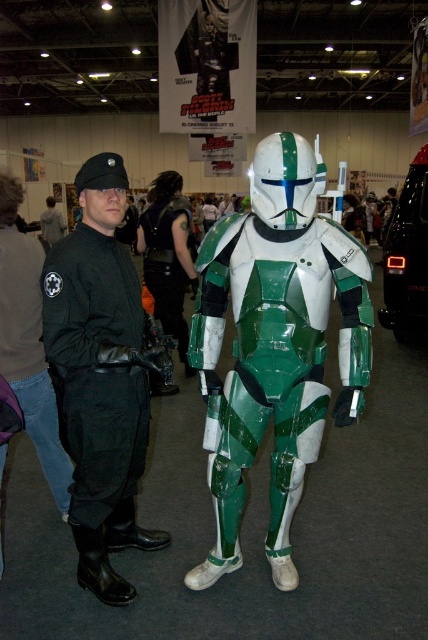
Does green matte armor at center appear on the left side of black matte jacket at left?

No, green matte armor at center is not to the left of black matte jacket at left.

Does green matte armor at center have a smaller size compared to black matte jacket at left?

No, green matte armor at center is not smaller than black matte jacket at left.

Where is `green matte armor at center`? This screenshot has width=428, height=640. green matte armor at center is located at coordinates (275, 344).

Who is higher up, black matte jacket at left or black leather vest at center?

black leather vest at center is higher up.

The height and width of the screenshot is (640, 428). I want to click on black matte jacket at left, so click(x=29, y=355).

Measure the distance from black leather jacket at left to black matte jacket at left.

black leather jacket at left and black matte jacket at left are 14.12 inches apart.

Is black leather jacket at left taller than black matte jacket at left?

Correct, black leather jacket at left is much taller as black matte jacket at left.

What are the coordinates of `black leather jacket at left` in the screenshot? It's located at (100, 378).

Where is `black leather jacket at left`? This screenshot has width=428, height=640. black leather jacket at left is located at coordinates (100, 378).